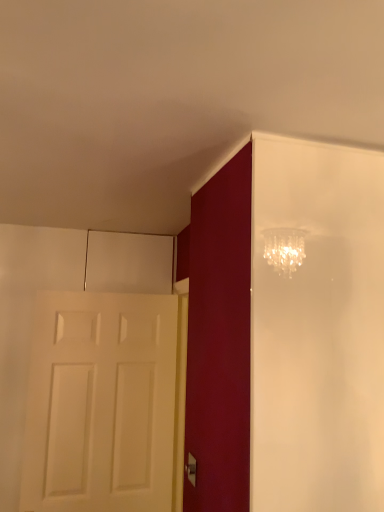
Question: Is the depth of white matte door at left greater than that of silver metallic door handle at lower center?

Choices:
 (A) yes
 (B) no

Answer: (A)

Question: Is white matte door at left looking in the opposite direction of silver metallic door handle at lower center?

Choices:
 (A) yes
 (B) no

Answer: (B)

Question: From the image's perspective, is white matte door at left above silver metallic door handle at lower center?

Choices:
 (A) yes
 (B) no

Answer: (A)

Question: Can you confirm if white matte door at left is positioned to the right of silver metallic door handle at lower center?

Choices:
 (A) yes
 (B) no

Answer: (B)

Question: Is white matte door at left far from silver metallic door handle at lower center?

Choices:
 (A) yes
 (B) no

Answer: (B)

Question: Is white matte door at left with silver metallic door handle at lower center?

Choices:
 (A) yes
 (B) no

Answer: (B)

Question: Does silver metallic door handle at lower center turn towards white matte door at left?

Choices:
 (A) yes
 (B) no

Answer: (B)

Question: From a real-world perspective, is silver metallic door handle at lower center located higher than white matte door at left?

Choices:
 (A) no
 (B) yes

Answer: (A)

Question: Can you confirm if silver metallic door handle at lower center is taller than white matte door at left?

Choices:
 (A) no
 (B) yes

Answer: (A)

Question: From the image's perspective, does silver metallic door handle at lower center appear higher than white matte door at left?

Choices:
 (A) no
 (B) yes

Answer: (A)

Question: Can you confirm if silver metallic door handle at lower center is wider than white matte door at left?

Choices:
 (A) yes
 (B) no

Answer: (B)

Question: From the image's perspective, does silver metallic door handle at lower center appear lower than white matte door at left?

Choices:
 (A) no
 (B) yes

Answer: (B)

Question: From a real-world perspective, relative to white matte door at left, is silver metallic door handle at lower center vertically above or below?

Choices:
 (A) above
 (B) below

Answer: (B)